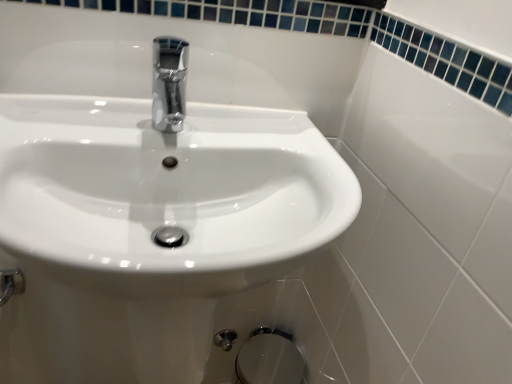
The width and height of the screenshot is (512, 384). I want to click on white glossy sink at center, so click(x=154, y=243).

Locate an element on the screen. The height and width of the screenshot is (384, 512). satin chrome bidet at lower center is located at coordinates (269, 358).

Which is closer, (258,366) or (106,282)?

Point (258,366).

Is satin chrome bidet at lower center beside white glossy sink at center?

There is a gap between satin chrome bidet at lower center and white glossy sink at center.

Could white glossy sink at center be considered to be inside satin chrome bidet at lower center?

No, satin chrome bidet at lower center does not contain white glossy sink at center.

Does satin chrome bidet at lower center have a lesser width compared to white glossy sink at center?

Yes, satin chrome bidet at lower center is thinner than white glossy sink at center.

Is chrome metallic faucet at center positioned in front of white glossy sink at center?

No, chrome metallic faucet at center is behind white glossy sink at center.

Which object is thinner, chrome metallic faucet at center or white glossy sink at center?

Thinner between the two is chrome metallic faucet at center.

This screenshot has width=512, height=384. What are the coordinates of `tap to the right of white glossy sink at center` in the screenshot? It's located at (169, 83).

Would you say chrome metallic faucet at center contains white glossy sink at center?

No, white glossy sink at center is not a part of chrome metallic faucet at center.

Is the depth of satin chrome bidet at lower center less than that of chrome metallic faucet at center?

No, it is behind chrome metallic faucet at center.

There is a satin chrome bidet at lower center. Where is `tap above it (from a real-world perspective)`? Image resolution: width=512 pixels, height=384 pixels. tap above it (from a real-world perspective) is located at coordinates (169, 83).

Would you consider satin chrome bidet at lower center to be distant from chrome metallic faucet at center?

No.

Consider the image. Is satin chrome bidet at lower center surrounding chrome metallic faucet at center?

That's incorrect, chrome metallic faucet at center is not inside satin chrome bidet at lower center.

Between point (170, 97) and point (255, 341), which one is positioned behind?

The point (255, 341) is farther from the camera.

Is chrome metallic faucet at center next to satin chrome bidet at lower center and touching it?

chrome metallic faucet at center and satin chrome bidet at lower center are not in contact.

Is satin chrome bidet at lower center surrounded by chrome metallic faucet at center?

Definitely not — satin chrome bidet at lower center is not inside chrome metallic faucet at center.

From a real-world perspective, between chrome metallic faucet at center and satin chrome bidet at lower center, who is vertically higher?

From a 3D spatial view, chrome metallic faucet at center is above.

Can you confirm if white glossy sink at center is positioned to the right of satin chrome bidet at lower center?

No.

Is white glossy sink at center next to satin chrome bidet at lower center?

No, white glossy sink at center is not next to satin chrome bidet at lower center.

Is satin chrome bidet at lower center inside white glossy sink at center?

No, satin chrome bidet at lower center is not surrounded by white glossy sink at center.

In the scene shown: Measure the distance between white glossy sink at center and satin chrome bidet at lower center.

white glossy sink at center and satin chrome bidet at lower center are 23.84 inches apart.

Is white glossy sink at center facing away from chrome metallic faucet at center?

No.

Is white glossy sink at center directly adjacent to chrome metallic faucet at center?

white glossy sink at center and chrome metallic faucet at center are clearly separated.

Considering the positions of objects white glossy sink at center and chrome metallic faucet at center in the image provided, who is in front, white glossy sink at center or chrome metallic faucet at center?

white glossy sink at center is closer to the camera.

Identify the location of tap that is behind the white glossy sink at center. (169, 83).

Find the location of a particular element. The height and width of the screenshot is (384, 512). sink lying in front of the satin chrome bidet at lower center is located at coordinates (154, 243).

The height and width of the screenshot is (384, 512). In the image, there is a chrome metallic faucet at center. In order to click on sink below it (from the image's perspective) in this screenshot , I will do `click(154, 243)`.

Considering their positions, is chrome metallic faucet at center positioned closer to white glossy sink at center than satin chrome bidet at lower center?

chrome metallic faucet at center lies closer to white glossy sink at center than the other object.

Which object lies further to the anchor point chrome metallic faucet at center, satin chrome bidet at lower center or white glossy sink at center?

satin chrome bidet at lower center is further to chrome metallic faucet at center.

Based on their spatial positions, is white glossy sink at center or chrome metallic faucet at center closer to satin chrome bidet at lower center?

Among the two, white glossy sink at center is located nearer to satin chrome bidet at lower center.

Which object lies further to the anchor point satin chrome bidet at lower center, chrome metallic faucet at center or white glossy sink at center?

The object further to satin chrome bidet at lower center is chrome metallic faucet at center.

When comparing their distances from chrome metallic faucet at center, does white glossy sink at center or satin chrome bidet at lower center seem further?

satin chrome bidet at lower center lies further to chrome metallic faucet at center than the other object.

Estimate the real-world distances between objects in this image. Which object is closer to white glossy sink at center, satin chrome bidet at lower center or chrome metallic faucet at center?

chrome metallic faucet at center.

The image size is (512, 384). I want to click on sink between chrome metallic faucet at center and satin chrome bidet at lower center in the vertical direction, so 154,243.